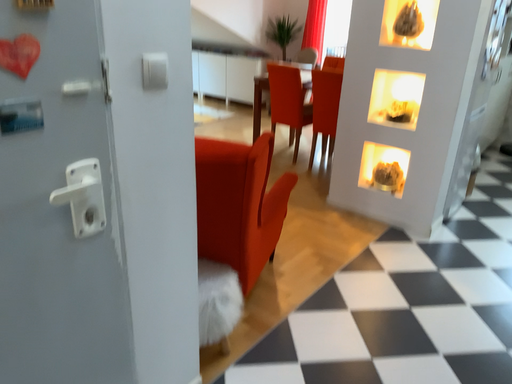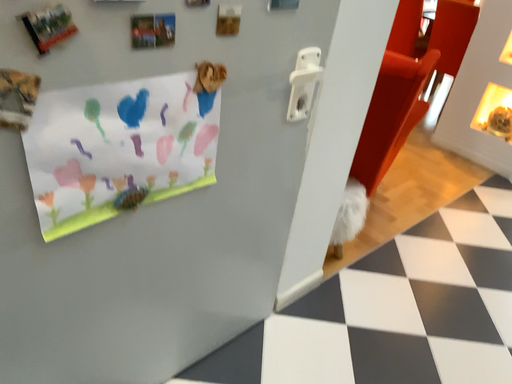
Question: Which way did the camera rotate in the video?

Choices:
 (A) rotated left
 (B) rotated right

Answer: (A)